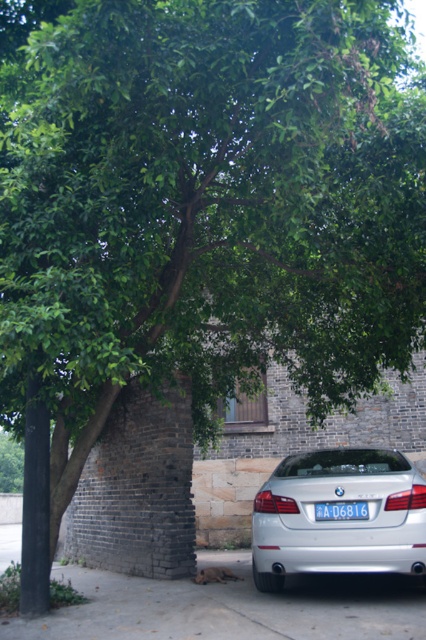
Question: Is silver metallic sedan at lower center to the right of blue metallic license plate at center from the viewer's perspective?

Choices:
 (A) no
 (B) yes

Answer: (A)

Question: Is silver metallic sedan at lower center closer to the viewer compared to blue metallic license plate at center?

Choices:
 (A) yes
 (B) no

Answer: (A)

Question: Among these objects, which one is nearest to the camera?

Choices:
 (A) gray concrete pavement at lower center
 (B) silver metallic sedan at lower center

Answer: (A)

Question: Which object is closer to the camera taking this photo?

Choices:
 (A) silver metallic sedan at lower center
 (B) gray concrete pavement at lower center
 (C) blue metallic license plate at center

Answer: (B)

Question: Is silver metallic sedan at lower center wider than blue metallic license plate at center?

Choices:
 (A) yes
 (B) no

Answer: (A)

Question: Which object is closer to the camera taking this photo?

Choices:
 (A) gray concrete pavement at lower center
 (B) silver metallic sedan at lower center

Answer: (A)